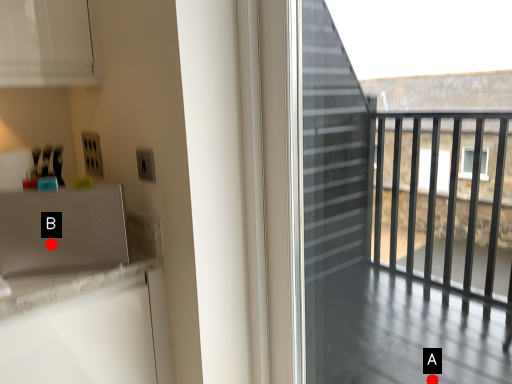
Question: Two points are circled on the image, labeled by A and B beside each circle. Among these points, which one is farthest from the camera?

Choices:
 (A) A is further
 (B) B is further

Answer: (A)